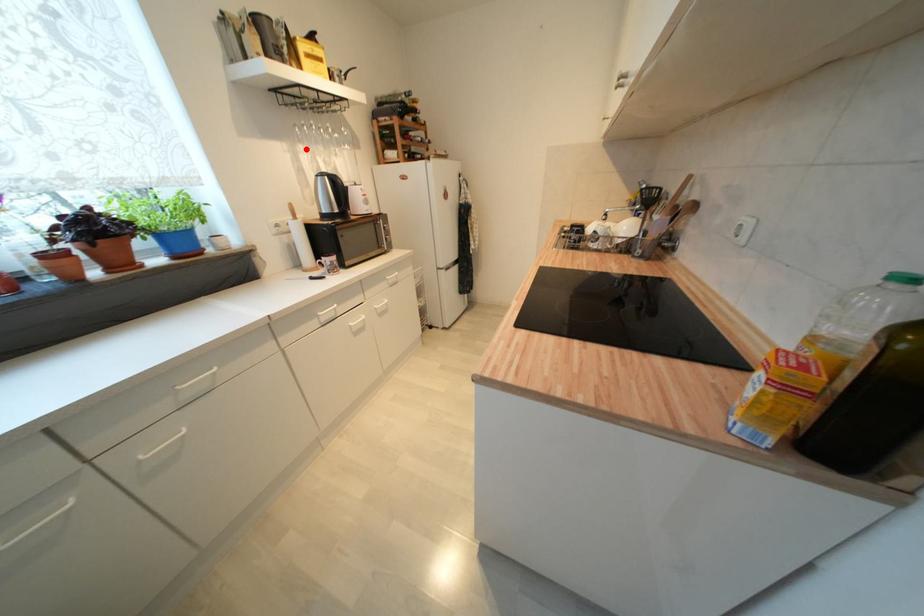
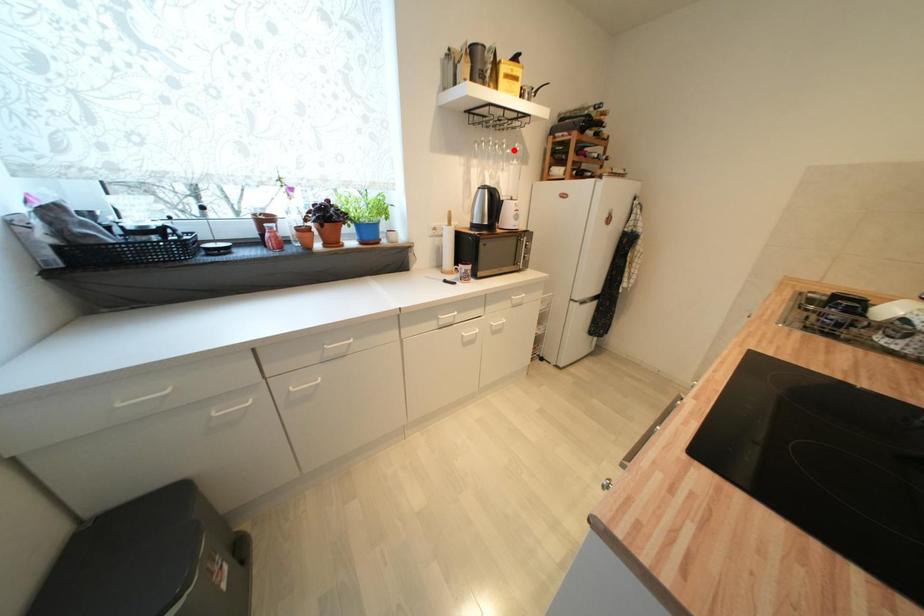
I am providing you with two images of the same scene from different viewpoints. A red point is marked on the first image and another point is marked on the second image. Do the highlighted points in image1 and image2 indicate the same real-world spot?

No